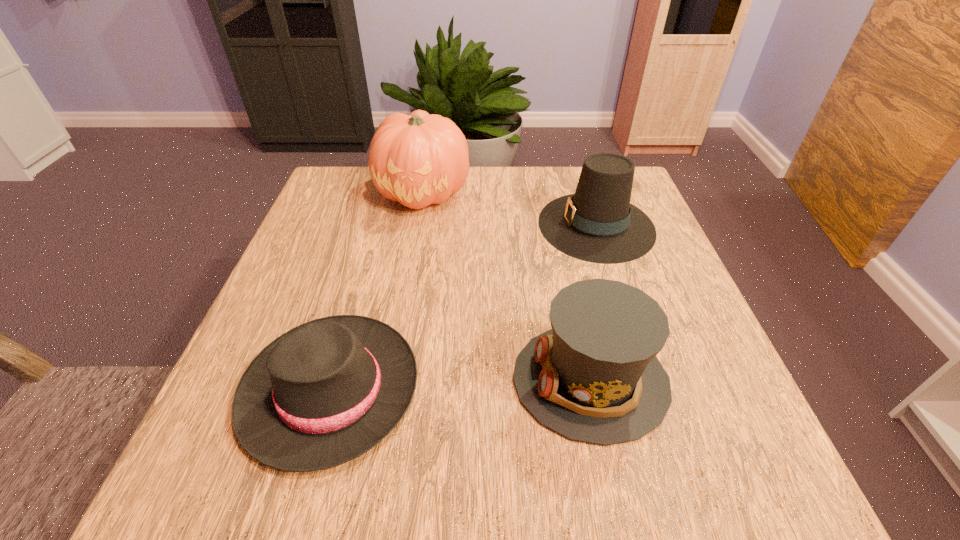
Find the location of a particular element. dress hat identified as the closest to the farthest dress hat is located at coordinates click(x=594, y=377).